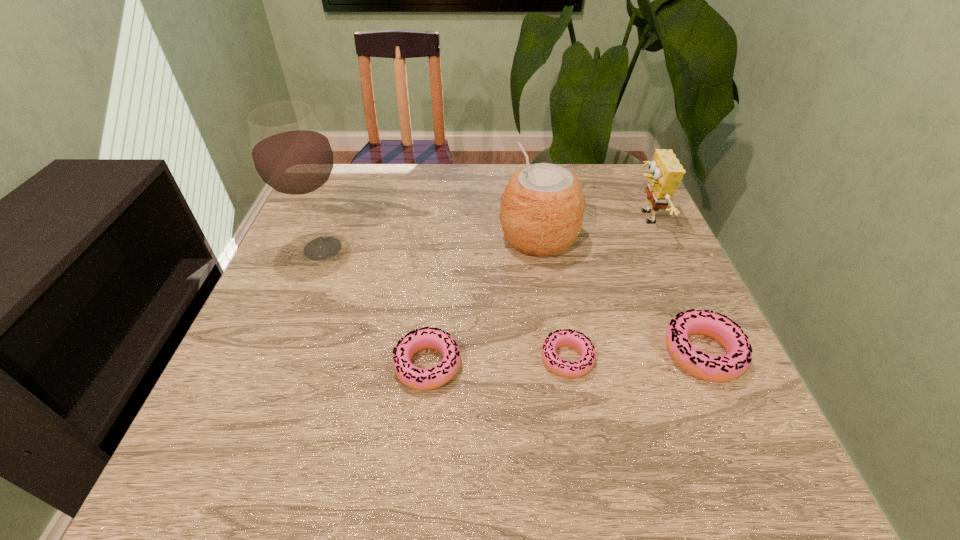
Where is `doughnut at the right edge`? doughnut at the right edge is located at coordinates (x=723, y=368).

The image size is (960, 540). I want to click on sponge that is at the right edge, so click(x=666, y=172).

At what (x,y) coordinates should I click in order to perform the action: click on object at the far right corner. Please return your answer as a coordinate pair (x, y). Looking at the image, I should click on (666, 172).

At what (x,y) coordinates should I click in order to perform the action: click on object located in the near right corner section of the desktop. Please return your answer as a coordinate pair (x, y). This screenshot has width=960, height=540. Looking at the image, I should click on (723, 368).

This screenshot has height=540, width=960. Find the location of `vacant space at the far edge`. vacant space at the far edge is located at coordinates (408, 167).

The image size is (960, 540). Find the location of `free space at the near edge`. free space at the near edge is located at coordinates (330, 423).

In the image, there is a desktop. Identify the location of vacant space at the left edge. (297, 226).

Where is `vacant point at the right edge`? This screenshot has height=540, width=960. vacant point at the right edge is located at coordinates (646, 337).

In the image, there is a desktop. At what (x,y) coordinates should I click in order to perform the action: click on free space at the far left corner. Please return your answer as a coordinate pair (x, y). Looking at the image, I should click on (338, 210).

You are a GUI agent. You are given a task and a screenshot of the screen. Output one action in this format:
    pyautogui.click(x=<x>, y=<y>)
    Task: Click on the vacant area at the near left corner
    
    Given the screenshot: What is the action you would take?
    pyautogui.click(x=245, y=426)